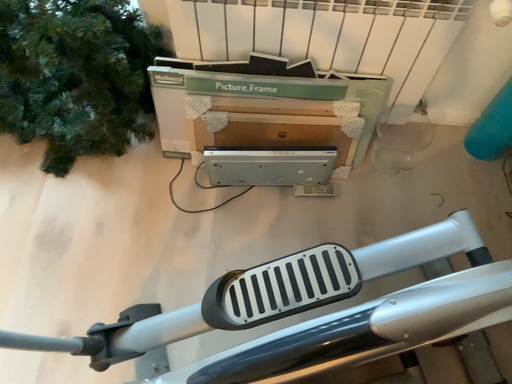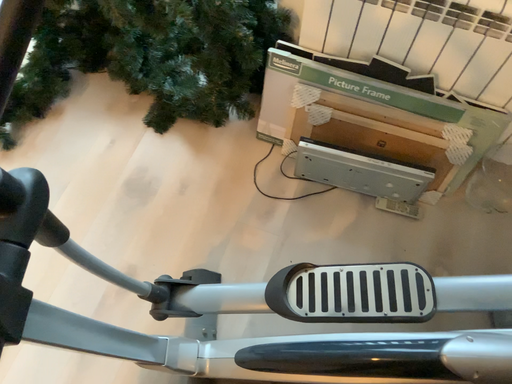
Question: How did the camera likely rotate when shooting the video?

Choices:
 (A) rotated right
 (B) rotated left

Answer: (B)